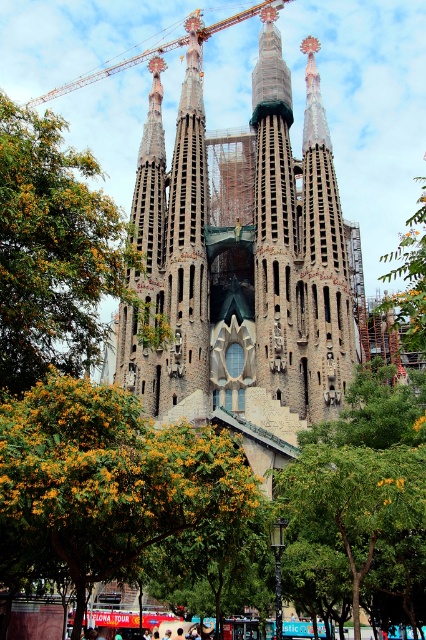
You are standing in front of the Sagrada Familia and want to reach the point marked at coordinates point (57, 525). If your walking speed is 3 feet per second, how many seconds will it take to reach that point?

The point (57, 525) is 141.59 feet away from the viewer. At a walking speed of 3 feet per second, it would take approximately 47.196 seconds to reach that point.

You are standing at the base of the Sagrada Familia and looking up at the structure. There are two points marked on the building. The first point is located at coordinates point (28, 525) and the second point is at point (63, 339). Which of these two points is closer to you, the observer?

Point (28, 525) is in front of point (63, 339), so it is closer to you.